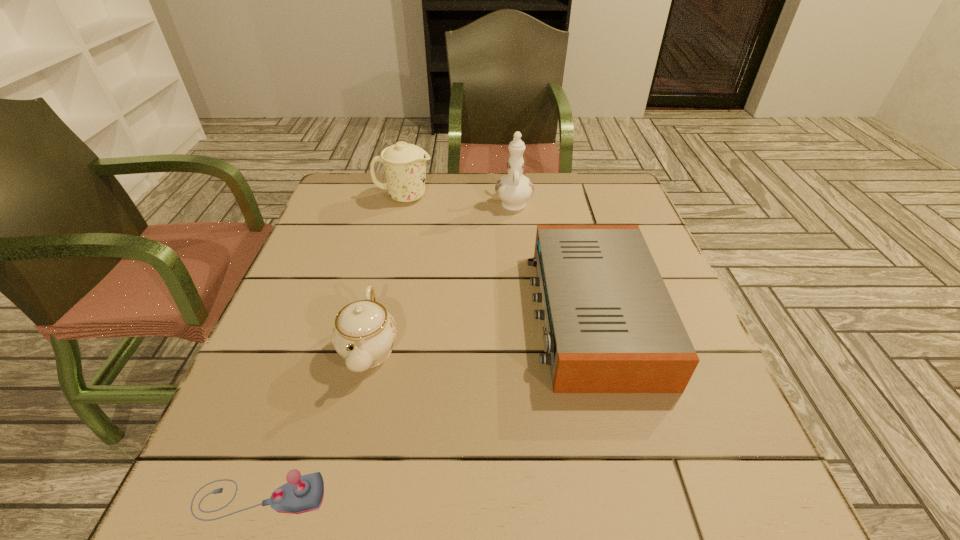
Find the location of a particular element. The width and height of the screenshot is (960, 540). vacant space in between the second tallest chinaware and the shortest chinaware is located at coordinates click(387, 273).

Identify the location of free space between the nearest chinaware and the second shortest object. (481, 332).

Identify which object is the fourth nearest to the tallest object. Please provide its 2D coordinates. Your answer should be formatted as a tuple, i.e. [(x, y)], where the tuple contains the x and y coordinates of a point satisfying the conditions above.

[(305, 493)]

Identify which object is located as the second nearest to the shortest object. Please provide its 2D coordinates. Your answer should be formatted as a tuple, i.e. [(x, y)], where the tuple contains the x and y coordinates of a point satisfying the conditions above.

[(610, 324)]

Where is `the closest chinaware to the rightmost chinaware`? the closest chinaware to the rightmost chinaware is located at coordinates (405, 164).

This screenshot has height=540, width=960. I want to click on chinaware identified as the second closest to the third shortest object, so click(x=514, y=189).

Image resolution: width=960 pixels, height=540 pixels. Find the location of `vacant space that satisfies the following two spatial constraints: 1. at the spout of the rightmost chinaware; 2. on the spout of the second shortest chinaware`. vacant space that satisfies the following two spatial constraints: 1. at the spout of the rightmost chinaware; 2. on the spout of the second shortest chinaware is located at coordinates (513, 197).

Locate an element on the screen. blank area in the image that satisfies the following two spatial constraints: 1. on the front panel of the radio receiver; 2. at the spout of the third tallest object is located at coordinates (601, 349).

Identify the location of free space that satisfies the following two spatial constraints: 1. on the spout of the second tallest object; 2. at the spout of the tallest object. The image size is (960, 540). (403, 202).

The width and height of the screenshot is (960, 540). In order to click on vacant space that satisfies the following two spatial constraints: 1. on the spout of the second tallest object; 2. at the spout of the tallest chinaware in this screenshot , I will do `click(403, 202)`.